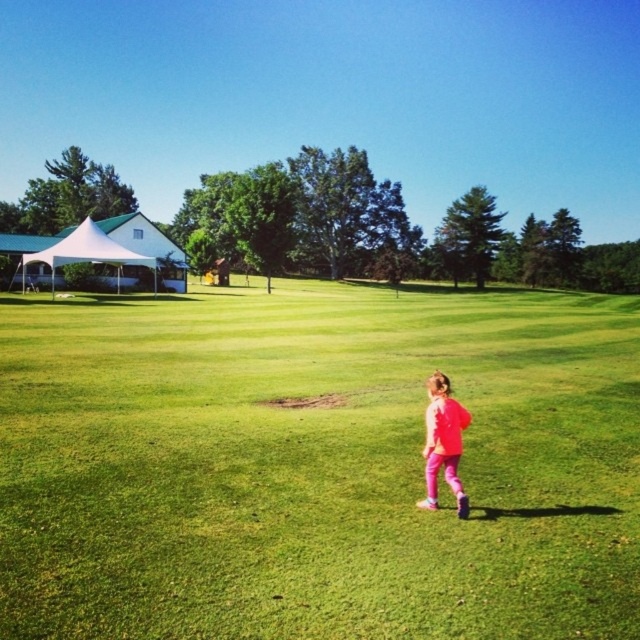
Question: Which point is farther from the camera taking this photo?

Choices:
 (A) (102, 262)
 (B) (452, 410)

Answer: (A)

Question: Does white fabric tent at left appear over pink matte pants at center?

Choices:
 (A) no
 (B) yes

Answer: (B)

Question: Does white fabric tent at left appear over pink matte pants at center?

Choices:
 (A) yes
 (B) no

Answer: (A)

Question: Which of these objects is positioned farthest from the white fabric tent at left?

Choices:
 (A) green grass at center
 (B) pink matte pants at center

Answer: (B)

Question: Which object is the closest to the green grass at center?

Choices:
 (A) white fabric tent at left
 (B) pink matte pants at center

Answer: (B)

Question: Does green grass at center appear on the left side of pink matte pants at center?

Choices:
 (A) no
 (B) yes

Answer: (A)